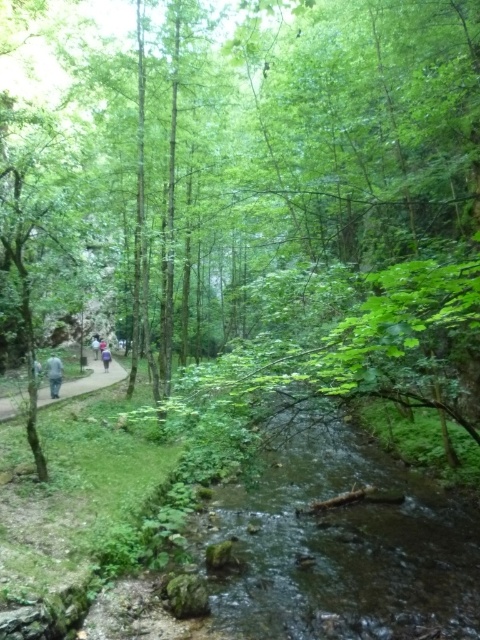
Between green fabric person at center and light blue jeans at left, which one appears on the right side from the viewer's perspective?

light blue jeans at left is more to the right.

Does point (48, 364) come farther from viewer compared to point (36, 362)?

Yes, it is behind point (36, 362).

Does point (52, 364) lie in front of point (36, 358)?

No, (52, 364) is behind (36, 358).

The image size is (480, 640). In order to click on green fabric person at center in this screenshot , I will do `click(54, 374)`.

Does point (105, 352) come closer to viewer compared to point (34, 365)?

That is False.

Consider the image. Can you confirm if light blue shirt at center is smaller than light blue jeans at left?

Correct, light blue shirt at center occupies less space than light blue jeans at left.

Locate an element on the screen. light blue shirt at center is located at coordinates (106, 356).

Can you confirm if green fabric person at center is smaller than light blue shirt at center?

No.

This screenshot has width=480, height=640. I want to click on green fabric person at center, so click(x=54, y=374).